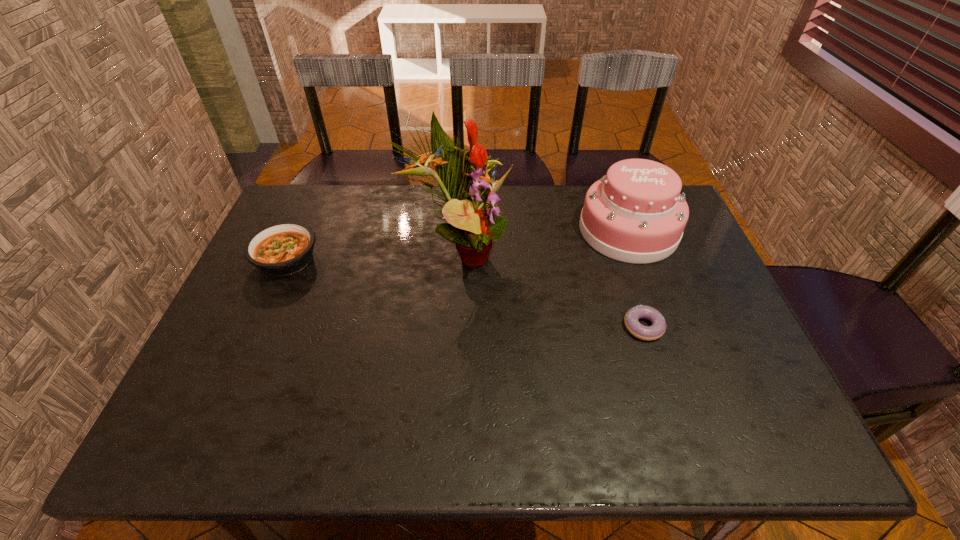
Locate an element on the screen. The height and width of the screenshot is (540, 960). free region located on the front of the doughnut is located at coordinates (665, 395).

Locate an element on the screen. The width and height of the screenshot is (960, 540). bouquet situated at the far edge is located at coordinates (474, 218).

Where is `cake that is at the far edge`? cake that is at the far edge is located at coordinates (635, 213).

Find the location of `object that is at the left edge`. object that is at the left edge is located at coordinates (281, 249).

The image size is (960, 540). I want to click on object that is positioned at the right edge, so click(x=635, y=213).

The height and width of the screenshot is (540, 960). I want to click on object at the far right corner, so click(x=635, y=213).

You are a GUI agent. You are given a task and a screenshot of the screen. Output one action in this format:
    pyautogui.click(x=<x>, y=<y>)
    Task: Click on the free space at the far edge of the desktop
    
    Given the screenshot: What is the action you would take?
    pyautogui.click(x=533, y=188)

You are a GUI agent. You are given a task and a screenshot of the screen. Output one action in this format:
    pyautogui.click(x=<x>, y=<y>)
    Task: Click on the vacant area at the near edge
    Image resolution: width=960 pixels, height=540 pixels.
    Given the screenshot: What is the action you would take?
    pyautogui.click(x=660, y=442)

Identify the location of vacant space at the left edge of the desktop. The image size is (960, 540). (263, 274).

The width and height of the screenshot is (960, 540). Find the location of `vacant region at the far left corner of the desktop`. vacant region at the far left corner of the desktop is located at coordinates (324, 201).